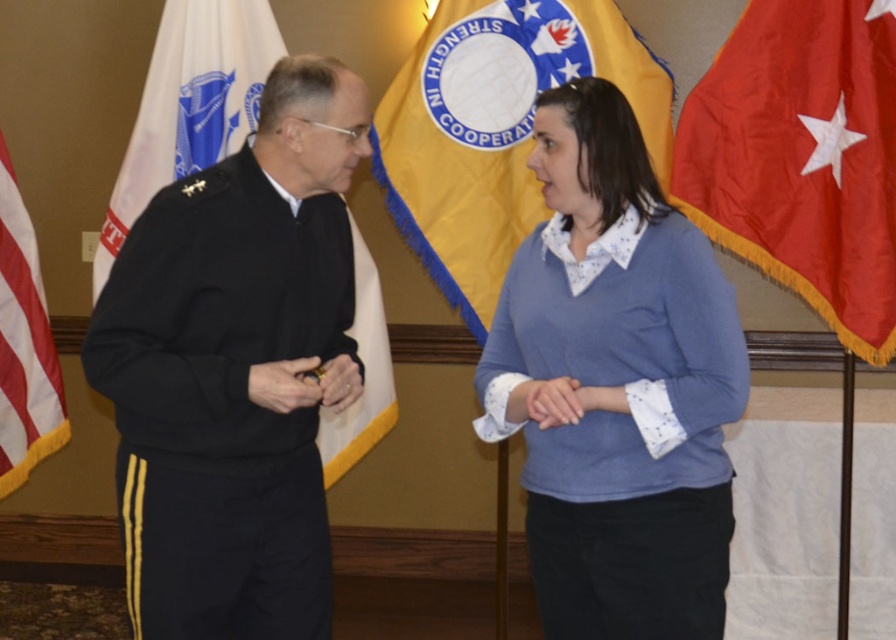
Question: Is red fabric flag at right behind matte blue sweater at center?

Choices:
 (A) no
 (B) yes

Answer: (B)

Question: Which of the following is the closest to the observer?

Choices:
 (A) red fabric flag at right
 (B) black uniform at left
 (C) matte black uniform at center

Answer: (B)

Question: Does yellow fabric flag at center appear over matte black uniform at center?

Choices:
 (A) no
 (B) yes

Answer: (B)

Question: Which is farther from the matte black ring at center?

Choices:
 (A) blue cotton sweater at center
 (B) matte blue sweater at center
 (C) matte black uniform at center

Answer: (A)

Question: Which point is farther from the camera taking this photo?

Choices:
 (A) (188, 534)
 (B) (622, 531)
 (C) (526, 419)
 (D) (260, 376)

Answer: (C)

Question: Can you confirm if yellow fabric flag at center is positioned to the right of red-white striped flag at left?

Choices:
 (A) yes
 (B) no

Answer: (A)